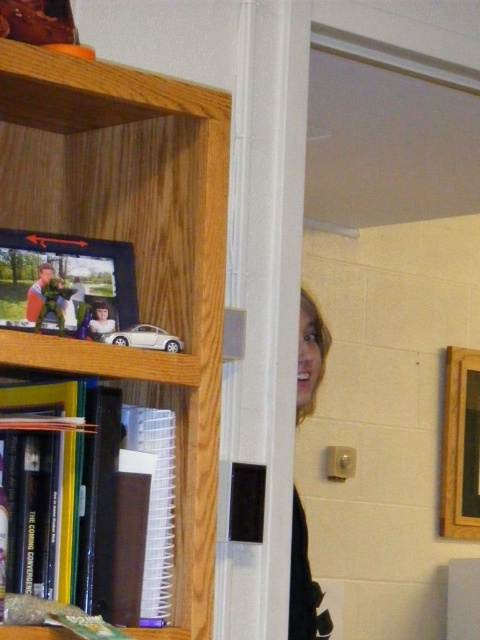
Question: From the image, what is the correct spatial relationship of matte plastic picture frame at left in relation to smooth black hair at door right?

Choices:
 (A) left
 (B) right

Answer: (A)

Question: Is wooden bookshelf at upper left bigger than smooth black hair at door right?

Choices:
 (A) yes
 (B) no

Answer: (A)

Question: Estimate the real-world distances between objects in this image. Which object is farther from the wooden picture frame at upper right?

Choices:
 (A) matte plastic picture frame at left
 (B) wooden bookshelf at upper left
 (C) smooth black hair at door right

Answer: (A)

Question: Which of these objects is positioned farthest from the wooden bookshelf at upper left?

Choices:
 (A) smooth black hair at door right
 (B) wooden picture frame at upper right
 (C) matte plastic picture frame at left

Answer: (B)

Question: Which point is farther to the camera?

Choices:
 (A) [x=453, y=497]
 (B) [x=155, y=236]

Answer: (A)

Question: Where is matte plastic picture frame at left located in relation to smooth black hair at door right in the image?

Choices:
 (A) below
 (B) above

Answer: (B)